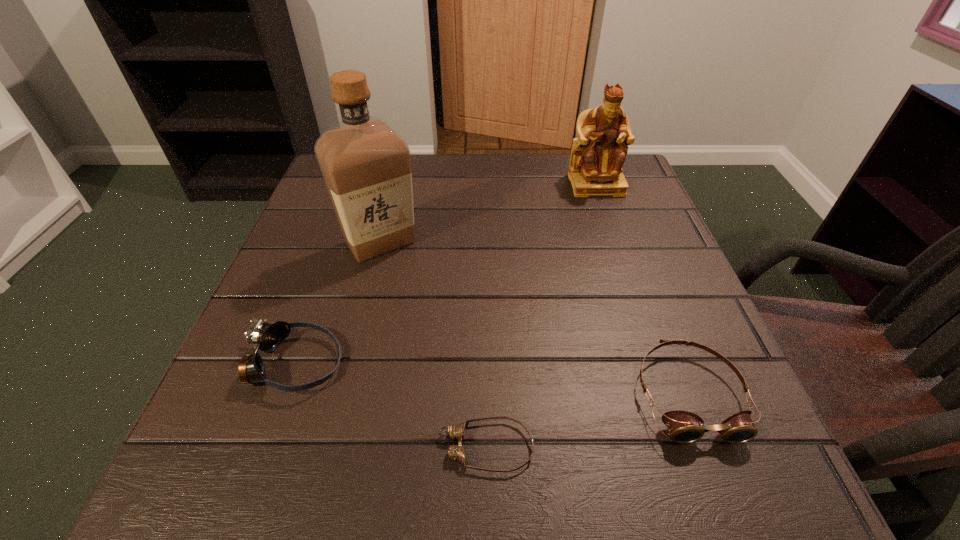
Locate an element on the screen. vacant point located between the fourth shortest object and the shortest object is located at coordinates (540, 315).

At what (x,y) coordinates should I click in order to perform the action: click on free space between the rightmost goggles and the tallest object. Please return your answer as a coordinate pair (x, y). This screenshot has height=540, width=960. Looking at the image, I should click on (534, 319).

This screenshot has width=960, height=540. Find the location of `vacant region between the tallest object and the rightmost goggles`. vacant region between the tallest object and the rightmost goggles is located at coordinates (534, 319).

You are a GUI agent. You are given a task and a screenshot of the screen. Output one action in this format:
    pyautogui.click(x=<x>, y=<y>)
    Task: Click on the vacant area that lies between the rightmost goggles and the leftmost goggles
    The width and height of the screenshot is (960, 540).
    Given the screenshot: What is the action you would take?
    pyautogui.click(x=492, y=379)

This screenshot has width=960, height=540. In order to click on vacant space that's between the liquor and the rightmost goggles in this screenshot , I will do `click(534, 319)`.

At what (x,y) coordinates should I click in order to perform the action: click on empty space between the rightmost goggles and the second farthest object. Please return your answer as a coordinate pair (x, y). The width and height of the screenshot is (960, 540). Looking at the image, I should click on (534, 319).

Find the location of a particular element. vacant area that lies between the farthest object and the leftmost goggles is located at coordinates (445, 274).

Where is `the closest object relative to the third object from left to right`? Image resolution: width=960 pixels, height=540 pixels. the closest object relative to the third object from left to right is located at coordinates (684, 427).

Where is `object that is the third closest to the tallest object`? object that is the third closest to the tallest object is located at coordinates (598, 154).

This screenshot has height=540, width=960. I want to click on the third closest goggles relative to the figurine, so click(x=266, y=337).